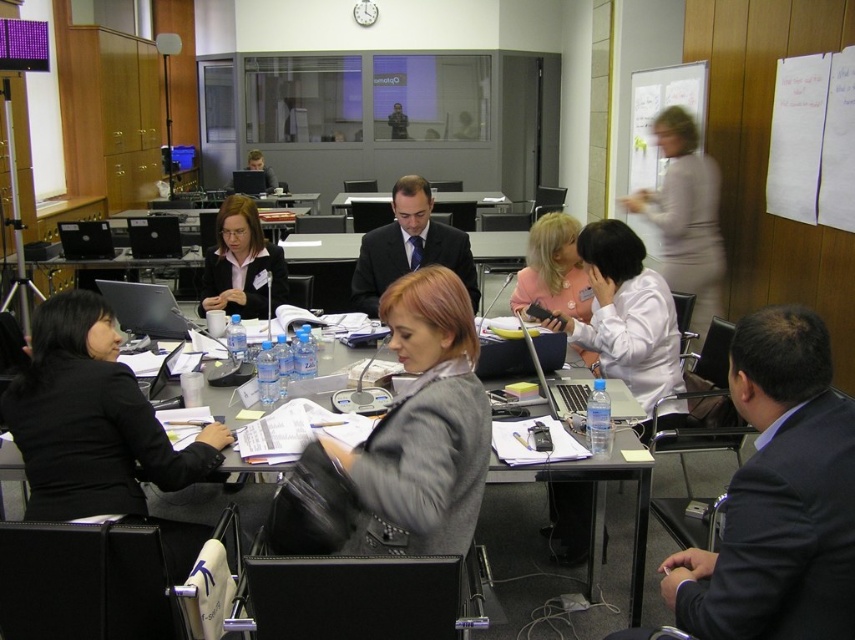
Does dark gray suit at center right appear on the right side of black matte jacket at left?

Correct, you'll find dark gray suit at center right to the right of black matte jacket at left.

Which of these two, dark gray suit at center right or black matte jacket at left, stands shorter?

dark gray suit at center right is shorter.

Identify the location of dark gray suit at center right. (783, 536).

Between matte black jacket at center and matte pink blouse at center, which one appears on the right side from the viewer's perspective?

Positioned to the right is matte pink blouse at center.

Measure the distance between matte black jacket at center and camera.

The distance of matte black jacket at center from camera is 3.57 meters.

Does point (251, 230) lie behind point (555, 269)?

Yes, it is behind point (555, 269).

What are the coordinates of `matte black jacket at center` in the screenshot? It's located at (242, 262).

Who is more forward, (404, 525) or (587, 294)?

Positioned in front is point (404, 525).

Is point (295, 497) farther from camera compared to point (576, 257)?

That is False.

Consider the image. Who is more distant from viewer, (429,365) or (534,300)?

Point (534,300)

You are a GUI agent. You are given a task and a screenshot of the screen. Output one action in this format:
    pyautogui.click(x=<x>, y=<y>)
    Task: Click on the gray textured blazer at center
    The image size is (855, 640).
    Given the screenshot: What is the action you would take?
    pyautogui.click(x=401, y=444)